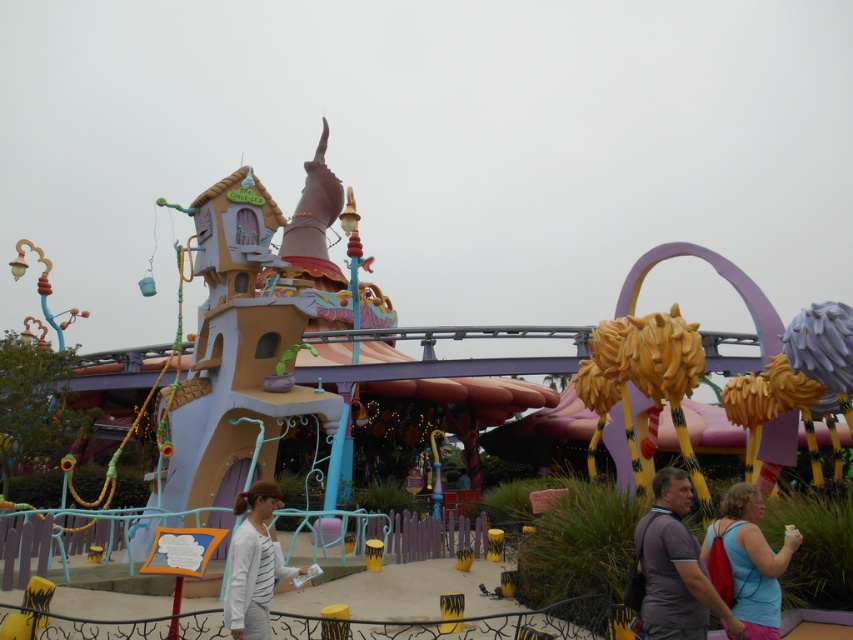
In the scene shown: You are a photographer trying to capture both the gray fabric shirt at lower center and the white striped shirt at center in a single frame. Which shirt should you focus on first if you want to ensure both are in the frame without moving the camera?

The gray fabric shirt at lower center is taller than the white striped shirt at center, so you should focus on the gray fabric shirt at lower center first to ensure both shirts are fully captured in the frame without cropping.

You are standing in the theme park scene described. You need to locate the gray fabric shirt at lower center. What are the coordinates where you should look?

The gray fabric shirt at lower center is located at coordinates point [675,566].